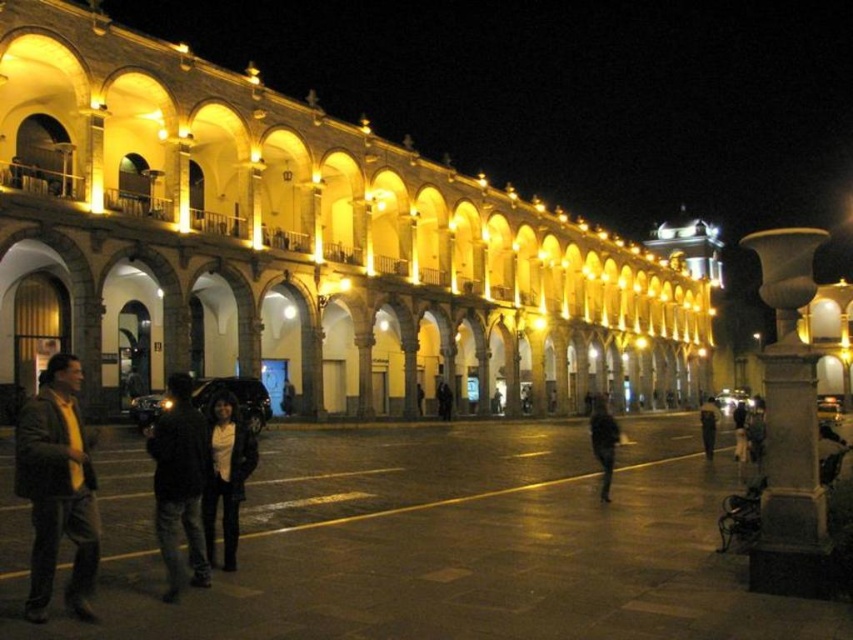
Does point (193, 426) come behind point (235, 545)?

No, (193, 426) is closer to viewer.

Is point (180, 442) closer to viewer compared to point (235, 497)?

Yes, it is in front of point (235, 497).

Does point (154, 435) lie behind point (221, 440)?

No, it is not.

Where is `dark blue jeans at center`? dark blue jeans at center is located at coordinates (178, 483).

How much distance is there between white stone column at right and black matte person at center?

white stone column at right is 28.41 meters away from black matte person at center.

Which is above, white stone column at right or black matte person at center?

Positioned higher is white stone column at right.

Measure the distance between point (795,291) and camera.

Point (795,291) is 42.30 meters away from camera.

You are a GUI agent. You are given a task and a screenshot of the screen. Output one action in this format:
    pyautogui.click(x=<x>, y=<y>)
    Task: Click on the white stone column at right
    The image size is (853, 640).
    Given the screenshot: What is the action you would take?
    pyautogui.click(x=788, y=426)

From the picture: Does white stone column at right have a smaller size compared to dark gray jacket at lower right?

No, white stone column at right is not smaller than dark gray jacket at lower right.

The width and height of the screenshot is (853, 640). What do you see at coordinates (788, 426) in the screenshot? I see `white stone column at right` at bounding box center [788, 426].

I want to click on white stone column at right, so click(788, 426).